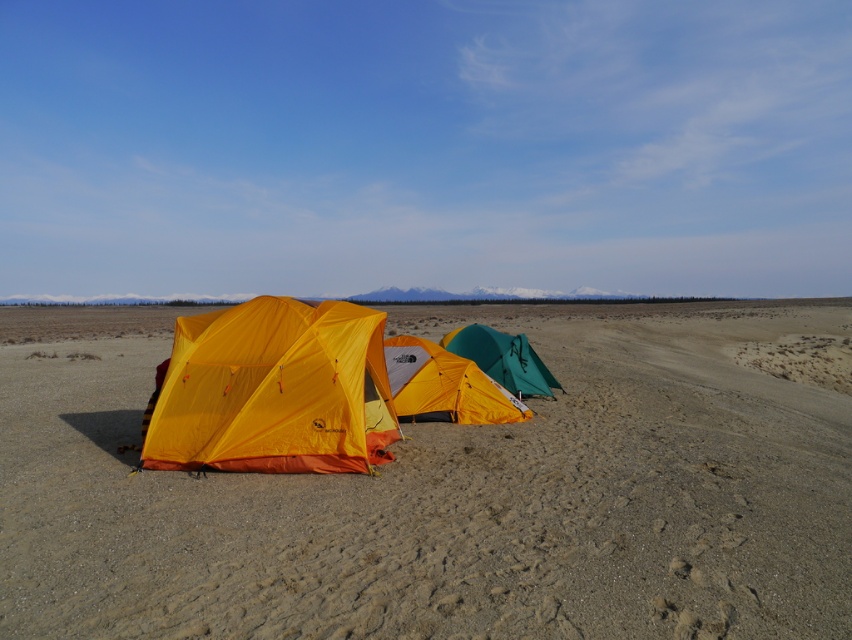
You are a GUI agent. You are given a task and a screenshot of the screen. Output one action in this format:
    pyautogui.click(x=<x>, y=<y>)
    Task: Click on the dirtgrainyfield at center
    
    Given the screenshot: What is the action you would take?
    pyautogui.click(x=448, y=492)

Based on the photo, does dirtgrainyfield at center have a larger size compared to matte yellow tent at center?

Yes.

Between point (44, 336) and point (448, 404), which one is positioned in front?

Point (448, 404) is more forward.

This screenshot has width=852, height=640. In order to click on dirtgrainyfield at center in this screenshot , I will do `click(448, 492)`.

Who is taller, orange tarpaulin tent at left or matte yellow tent at center?

orange tarpaulin tent at left

Does orange tarpaulin tent at left appear over matte yellow tent at center?

Indeed, orange tarpaulin tent at left is positioned over matte yellow tent at center.

Does point (343, 435) come in front of point (504, 406)?

Yes, point (343, 435) is in front of point (504, 406).

Image resolution: width=852 pixels, height=640 pixels. I want to click on orange tarpaulin tent at left, so click(274, 390).

Is dirtgrainyfield at center to the right of orange tarpaulin tent at left from the viewer's perspective?

Incorrect, dirtgrainyfield at center is not on the right side of orange tarpaulin tent at left.

I want to click on dirtgrainyfield at center, so tap(448, 492).

Find the location of `dirtgrainyfield at center`. dirtgrainyfield at center is located at coordinates (448, 492).